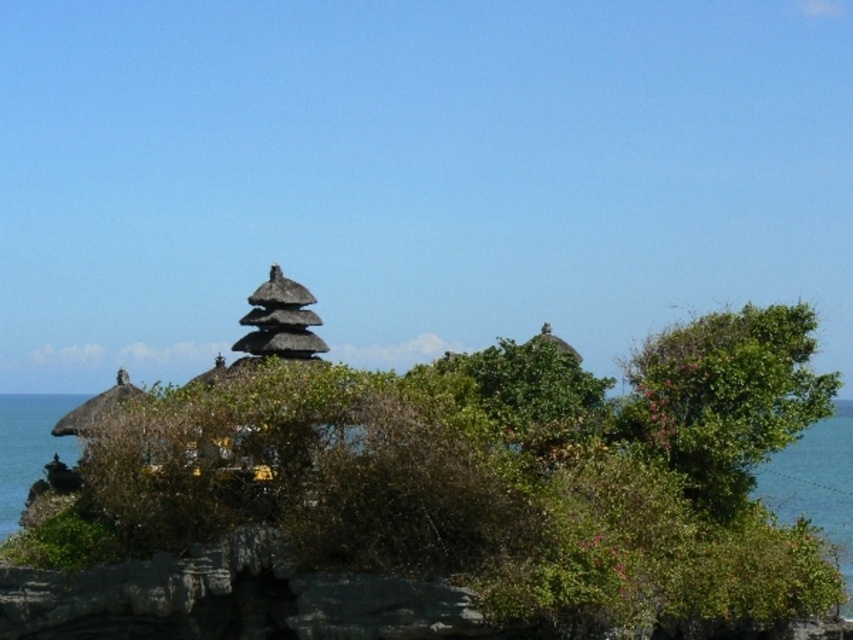
Question: Which point appears closest to the camera in this image?

Choices:
 (A) (840, 531)
 (B) (750, 323)

Answer: (B)

Question: Does green leafy bush at right have a smaller size compared to blue water at lower right?

Choices:
 (A) yes
 (B) no

Answer: (A)

Question: Can you confirm if green leafy bush at right is positioned to the left of blue water at lower right?

Choices:
 (A) yes
 (B) no

Answer: (A)

Question: Which point appears farthest from the camera in this image?

Choices:
 (A) (695, 332)
 (B) (790, 460)

Answer: (B)

Question: Observing the image, what is the correct spatial positioning of green leafy bush at right in reference to blue water at lower right?

Choices:
 (A) above
 (B) below

Answer: (A)